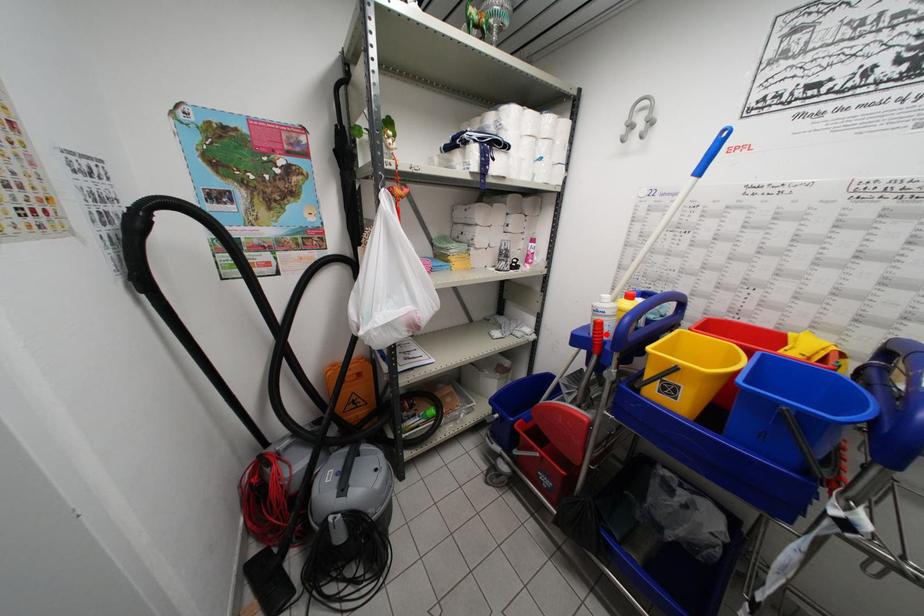
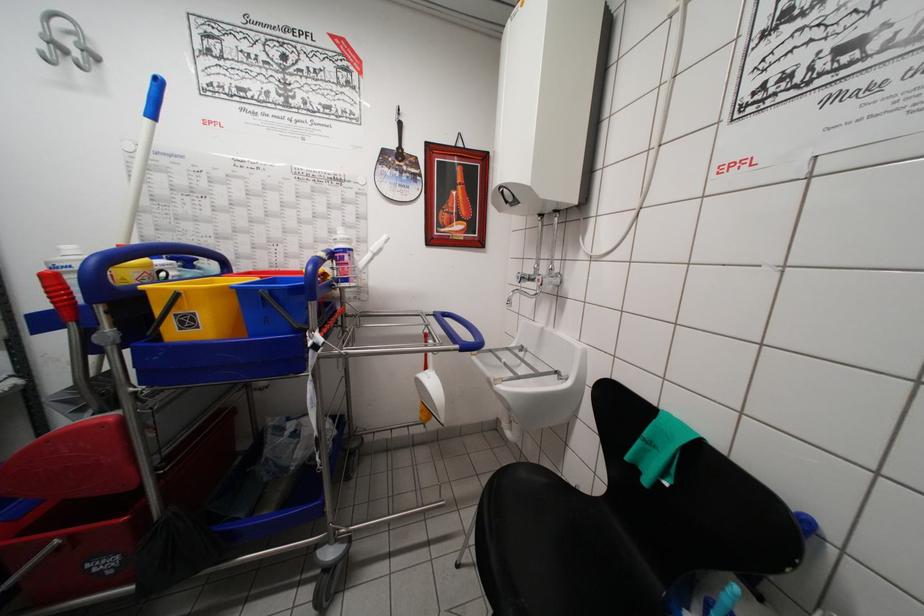
Locate, in the second image, the point that corresponds to the highlighted location in the first image.

(67, 289)